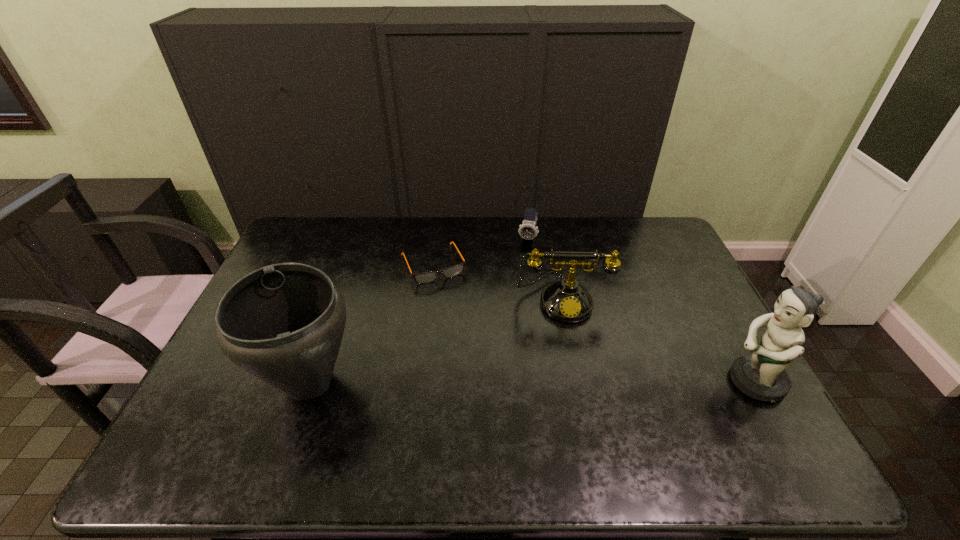
You are a GUI agent. You are given a task and a screenshot of the screen. Output one action in this format:
    pyautogui.click(x=<x>, y=<y>)
    Task: Click on the vacant point located between the rightmost object and the telephone
    The image size is (960, 540).
    Given the screenshot: What is the action you would take?
    pyautogui.click(x=658, y=340)

Find the location of a particular element. This screenshot has width=960, height=540. free spot between the urn and the third shortest object is located at coordinates (436, 340).

The width and height of the screenshot is (960, 540). I want to click on vacant region between the watch and the urn, so click(419, 310).

Identify the location of object that stands as the second closest to the leftmost object. (567, 301).

Identify which object is the third nearest to the figurine. Please provide its 2D coordinates. Your answer should be formatted as a tuple, i.e. [(x, y)], where the tuple contains the x and y coordinates of a point satisfying the conditions above.

[(426, 277)]

Locate an element on the screen. blank space that satisfies the following two spatial constraints: 1. on the front side of the telephone; 2. on the front-facing side of the rightmost object is located at coordinates (579, 381).

Locate an element on the screen. Image resolution: width=960 pixels, height=540 pixels. vacant region that satisfies the following two spatial constraints: 1. on the back side of the fourth object from right to left; 2. on the left side of the watch is located at coordinates (436, 238).

Identify the location of blank area in the image that satisfies the following two spatial constraints: 1. on the front side of the figurine; 2. on the front-facing side of the telephone. (579, 381).

I want to click on vacant region that satisfies the following two spatial constraints: 1. on the back side of the figurine; 2. on the front-facing side of the leftmost object, so click(x=310, y=381).

Identify the location of vacant point that satisfies the following two spatial constraints: 1. on the back side of the urn; 2. on the right side of the telephone. Image resolution: width=960 pixels, height=540 pixels. (338, 299).